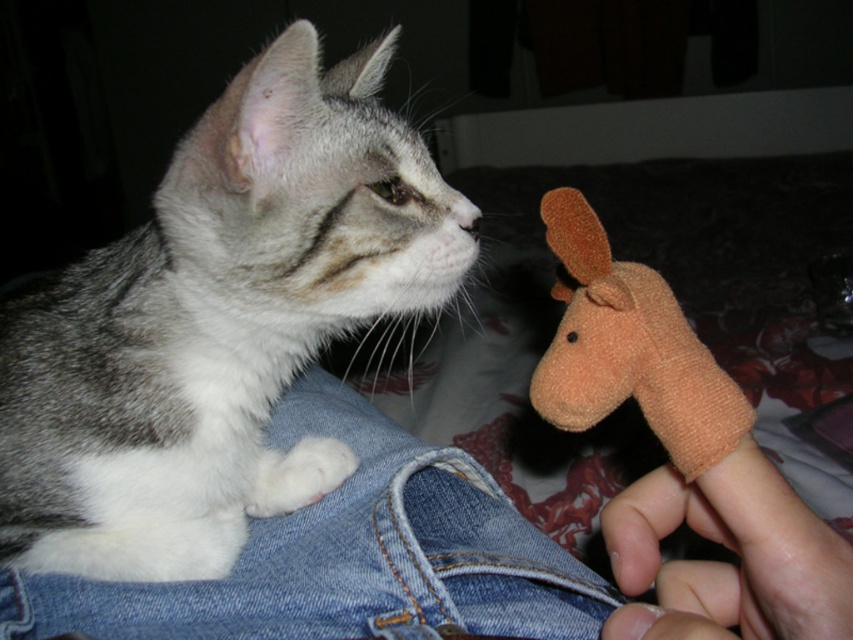
Question: Which point is closer to the camera?

Choices:
 (A) gray tabby cat at center
 (B) orange fuzzy finger puppet at right
 (C) orange fabric finger puppet at lower right

Answer: (C)

Question: Is the position of denim at left more distant than that of denim pocket at lower left?

Choices:
 (A) no
 (B) yes

Answer: (B)

Question: Is denim at left thinner than orange fuzzy finger puppet at right?

Choices:
 (A) yes
 (B) no

Answer: (B)

Question: Is denim at left wider than denim pocket at lower left?

Choices:
 (A) yes
 (B) no

Answer: (A)

Question: Which object is positioned farthest from the denim pocket at lower left?

Choices:
 (A) denim at left
 (B) orange fuzzy finger puppet at right
 (C) gray tabby cat at center
 (D) orange fabric finger puppet at lower right

Answer: (C)

Question: Which point is farther to the camera?

Choices:
 (A) orange fabric finger puppet at lower right
 (B) gray tabby cat at center

Answer: (B)